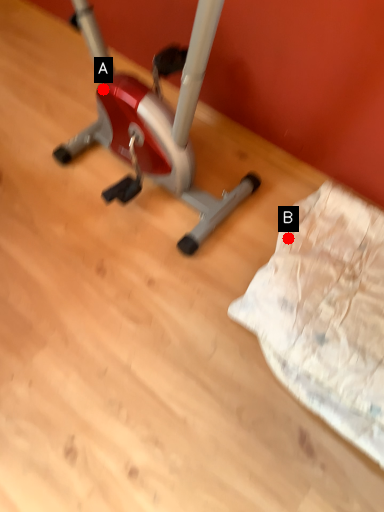
Question: Two points are circled on the image, labeled by A and B beside each circle. Which point is closer to the camera?

Choices:
 (A) A is closer
 (B) B is closer

Answer: (B)